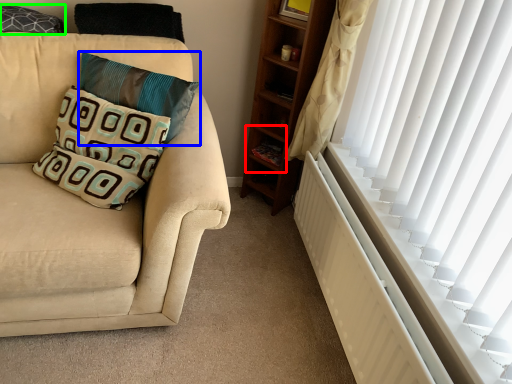
Question: Based on their relative distances, which object is nearer to shelf (highlighted by a red box)? Choose from pillow (highlighted by a blue box) and pillow (highlighted by a green box).

Choices:
 (A) pillow
 (B) pillow

Answer: (A)